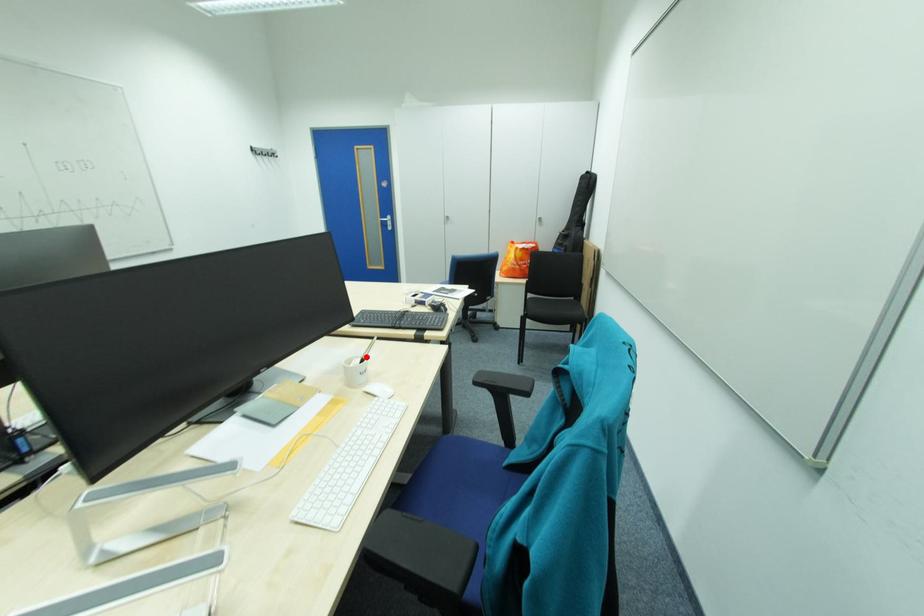
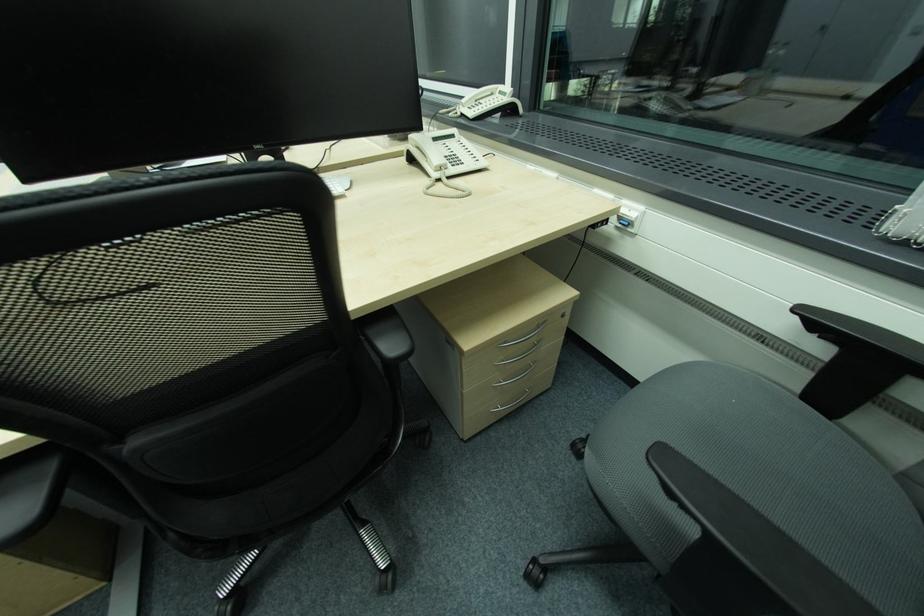
Question: I am providing you with two images of the same scene from different viewpoints. A red point is marked on the first image. At the location where the point appears in image 1, is it still visible in image 2?

Choices:
 (A) Yes
 (B) No

Answer: (B)